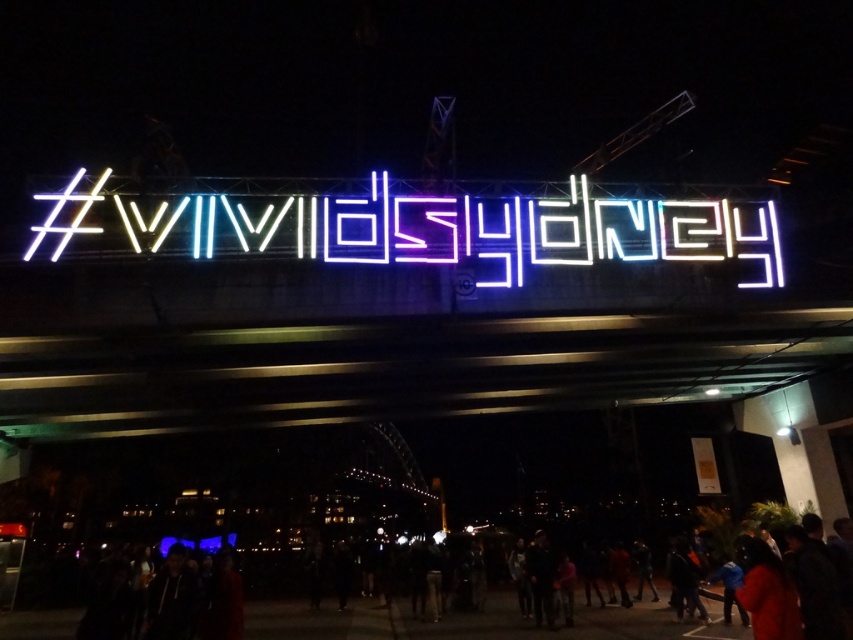
You are a photographer trying to capture the neontextsign at center and the black jacket at lower center in the same frame. Based on their sizes in the image, which object would appear larger in your photo?

The black jacket at lower center appears larger in the image than the neontextsign at center, so it would be the larger object in the photo.